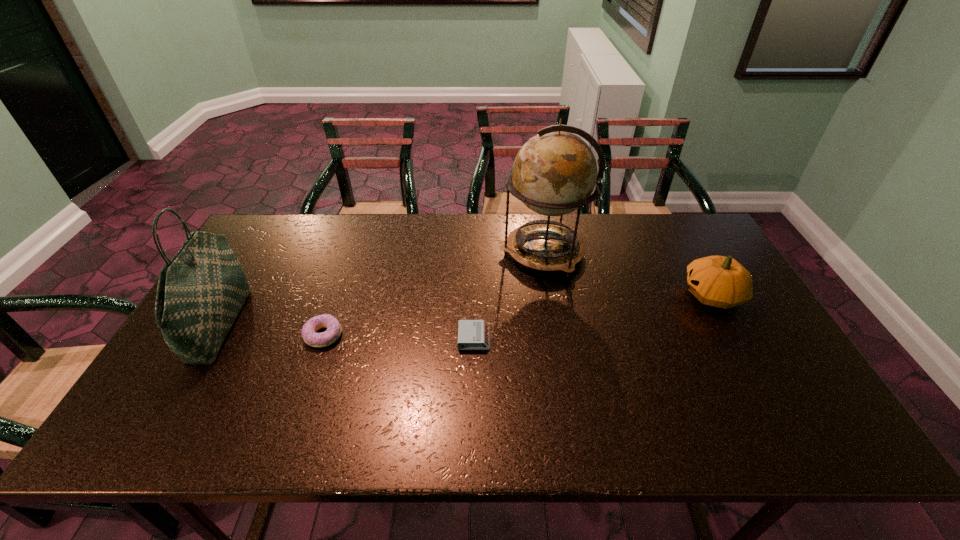
Locate an element on the screen. The width and height of the screenshot is (960, 540). vacant space located 0.140m at the center of the globe is located at coordinates (456, 252).

This screenshot has width=960, height=540. Identify the location of free space located 0.250m at the center of the globe. (422, 252).

Locate an element on the screen. This screenshot has height=540, width=960. free space located 0.220m at the center of the globe is located at coordinates (432, 252).

Image resolution: width=960 pixels, height=540 pixels. I want to click on vacant space located 0.250m on the back of the tote bag, so click(275, 233).

What are the coordinates of `vacant space located on the side of the third tallest object with the carved face` in the screenshot? It's located at (610, 295).

Locate an element on the screen. The width and height of the screenshot is (960, 540). free location located 0.400m on the side of the third tallest object with the carved face is located at coordinates (544, 295).

Locate an element on the screen. This screenshot has height=540, width=960. vacant space located 0.360m on the side of the third tallest object with the carved face is located at coordinates (x=558, y=295).

The width and height of the screenshot is (960, 540). Identify the location of vacant space located on the right of the doughnut. (376, 335).

At what (x,y) coordinates should I click in order to perform the action: click on vacant space situated 0.200m on the right of the alarm clock. Please return your answer as a coordinate pair (x, y). The width and height of the screenshot is (960, 540). Looking at the image, I should click on (565, 339).

This screenshot has height=540, width=960. Find the location of `object that is at the far edge`. object that is at the far edge is located at coordinates click(x=554, y=173).